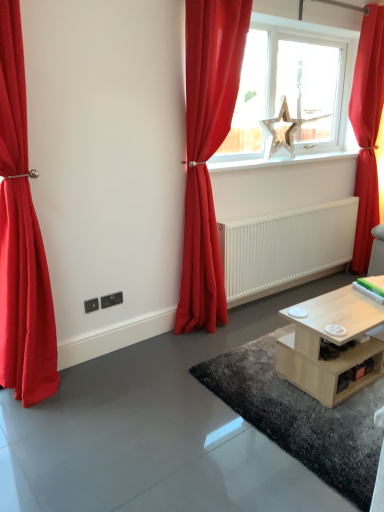
At what (x,y) coordinates should I click in order to perform the action: click on empty space that is to the right of matte red curtain at left, the first curtain positioned from the left. Please return your answer as a coordinate pair (x, y). Looking at the image, I should click on (94, 396).